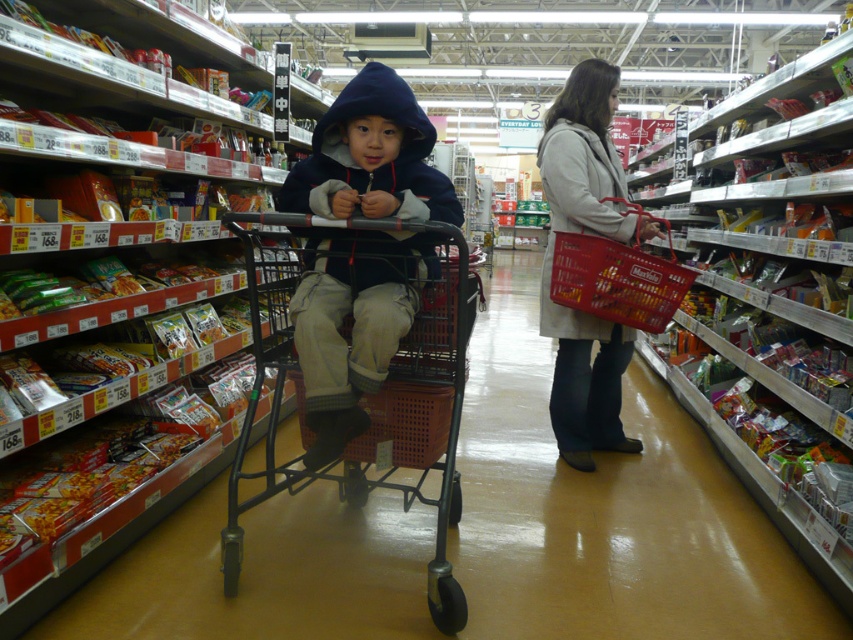
Is dark blue fleece jacket at center positioned at the back of gray wool coat at center?

That is False.

Does point (393, 144) lie behind point (587, 200)?

No, it is in front of (587, 200).

Does point (334, 166) come closer to viewer compared to point (543, 262)?

Yes, it is in front of point (543, 262).

Locate an element on the screen. The width and height of the screenshot is (853, 640). dark blue fleece jacket at center is located at coordinates (352, 324).

Is point (418, 356) positioned in front of point (599, 176)?

That is True.

Is metallic shopping cart at center smaller than gray wool coat at center?

Yes, metallic shopping cart at center is smaller than gray wool coat at center.

Describe the element at coordinates (364, 394) in the screenshot. I see `metallic shopping cart at center` at that location.

Identify the location of metallic shopping cart at center. (364, 394).

How much distance is there between dark blue fleece jacket at center and metallic shopping cart at center?

The distance of dark blue fleece jacket at center from metallic shopping cart at center is 7.12 inches.

Identify the location of dark blue fleece jacket at center. Image resolution: width=853 pixels, height=640 pixels. (352, 324).

The height and width of the screenshot is (640, 853). Identify the location of dark blue fleece jacket at center. (352, 324).

At what (x,y) coordinates should I click in order to perform the action: click on dark blue fleece jacket at center. Please return your answer as a coordinate pair (x, y). The height and width of the screenshot is (640, 853). Looking at the image, I should click on (352, 324).